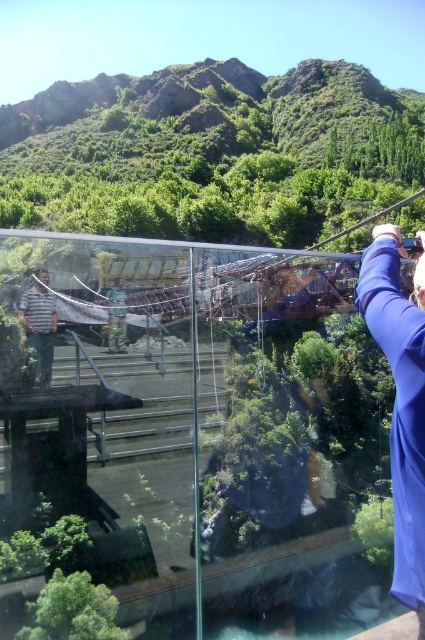
You are standing on the glass walkway and see your reflection. In your reflection, you notice two fabrics. The blue fabric at right and the striped fabric shirt at left. Which fabric is closer to the edge of the walkway?

The blue fabric at right is positioned under the striped fabric shirt at left, meaning it is closer to the edge of the walkway.

You are standing on the glass walkway and want to take a photo of the blue fabric at right without your feet appearing in the reflection. The camera is in your hand. What should you do?

Move 1.52 meters away from the blue fabric at right so that the camera is positioned where your feet won

You are standing on the glass walkway and notice a point marked at coordinates (x=401, y=401). What object is located at that point?

The point at (x=401, y=401) indicates a blue fabric at right.